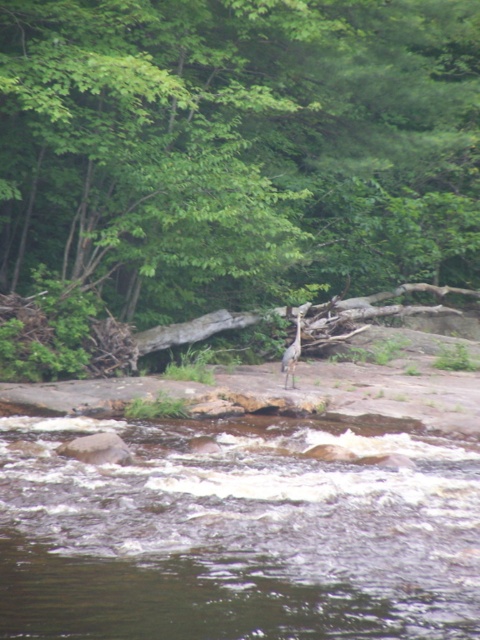
Does point (144, 202) come farther from viewer compared to point (285, 372)?

No.

Locate an element on the screen. The width and height of the screenshot is (480, 640). green leafy tree at center is located at coordinates (233, 150).

Does brown smooth water at lower center lie behind gray matte bird at center?

No, brown smooth water at lower center is in front of gray matte bird at center.

Does point (271, 636) come in front of point (287, 385)?

That is True.

Identify the location of brown smooth water at lower center. (x=236, y=536).

Which is below, green leafy tree at center or brown smooth water at lower center?

brown smooth water at lower center is below.

Which is behind, point (436, 275) or point (425, 630)?

The point (436, 275) is behind.

Locate an element on the screen. The width and height of the screenshot is (480, 640). green leafy tree at center is located at coordinates point(233,150).